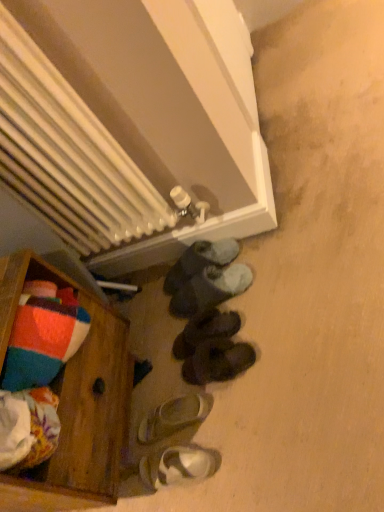
Where is `blank space to the left of white matte sandal at lower center, which is the fifth footwear from top to bottom`? blank space to the left of white matte sandal at lower center, which is the fifth footwear from top to bottom is located at coordinates (135, 457).